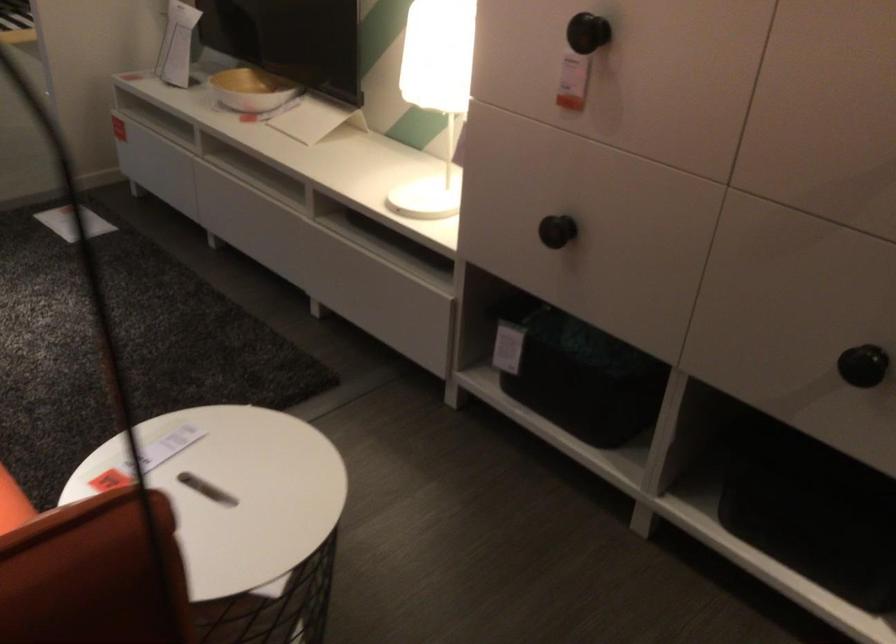
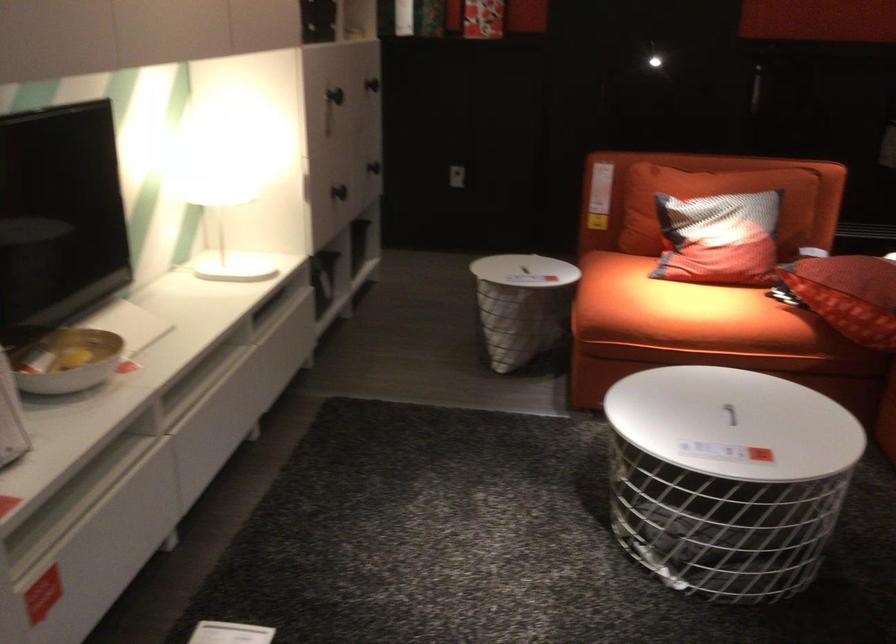
The point at (556,231) is marked in the first image. Where is the corresponding point in the second image?

(358, 180)